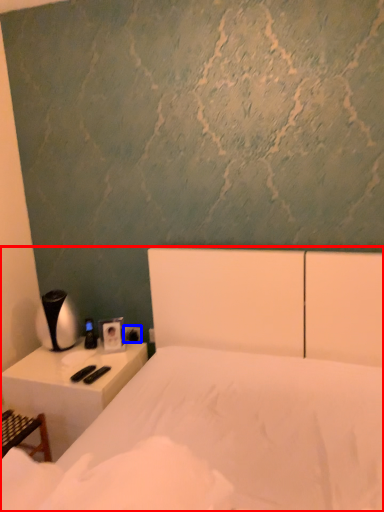
Question: Among these objects, which one is nearest to the camera, bed (highlighted by a red box) or electric outlet (highlighted by a blue box)?

Choices:
 (A) bed
 (B) electric outlet

Answer: (A)